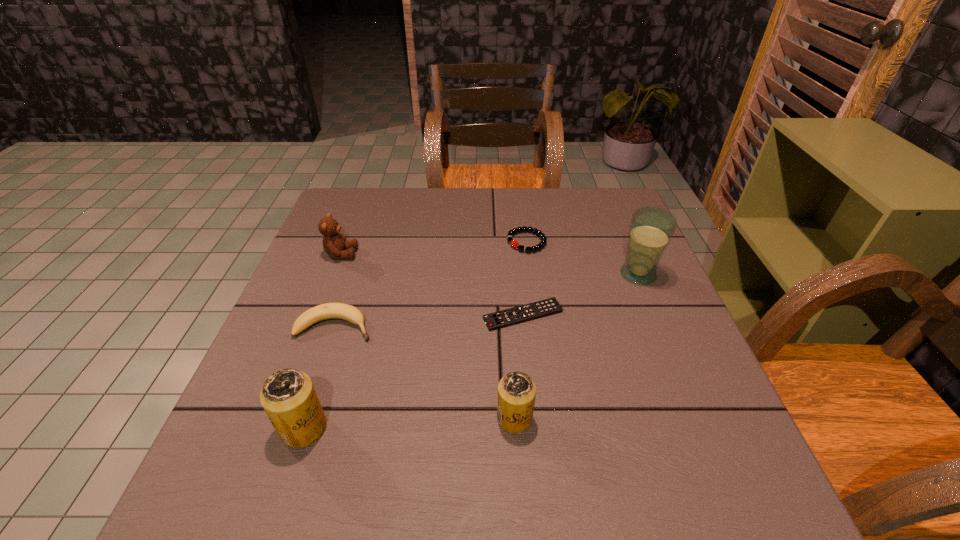
Locate an element on the screen. the taller beer can is located at coordinates (288, 396).

Identify the location of the left beer can. (288, 396).

The width and height of the screenshot is (960, 540). I want to click on the shorter beer can, so click(516, 391).

Where is `the second shortest object`? the second shortest object is located at coordinates (513, 243).

Where is `teddy bear`? This screenshot has height=540, width=960. teddy bear is located at coordinates click(x=335, y=245).

This screenshot has width=960, height=540. In order to click on glass in this screenshot , I will do pyautogui.click(x=651, y=228).

Find the location of a particular element. The height and width of the screenshot is (540, 960). the tallest object is located at coordinates (651, 228).

You are a GUI agent. You are given a task and a screenshot of the screen. Output one action in this format:
    pyautogui.click(x=<x>, y=<y>)
    Task: Click on the banana
    Image resolution: width=960 pixels, height=540 pixels.
    Given the screenshot: What is the action you would take?
    [325, 311]

Locate an element on the screen. The height and width of the screenshot is (540, 960). the shortest object is located at coordinates (512, 316).

At what (x,y) coordinates should I click in order to perform the action: click on free space located on the left of the left beer can. Please return your answer as a coordinate pair (x, y). This screenshot has width=960, height=540. Looking at the image, I should click on (230, 428).